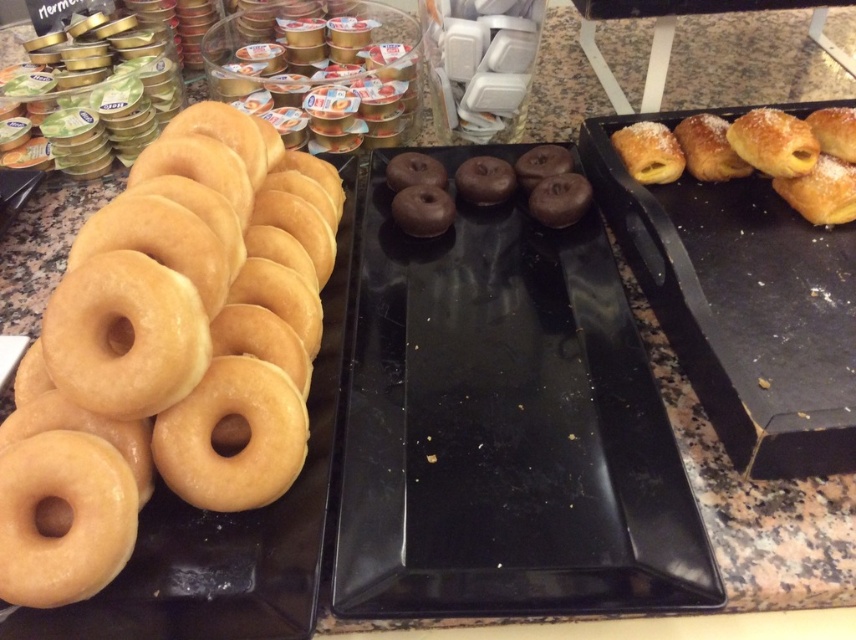
You are a customer at a bakery and see the glossy glazed donut at left and the golden matte donut at left. Which one is placed higher on the tray?

The glossy glazed donut at left is positioned over golden matte donut at left, so it is placed higher on the tray.

You are a customer at a bakery and you want to choose a donut that is taller. You see the glossy glazed donut at left and the golden matte donut at left. Which one should you pick?

The glossy glazed donut at left is taller than the golden matte donut at left, so you should pick the glossy glazed donut at left.

You are standing in front of a display of baked goods. There are three trays on the countertop. The left tray has golden glazed donuts, the center tray has chocolate donuts, and the right tray has powdered sugar pastries. A customer points to a specific location on the display and says, I want the item at point (169,353). Which tray should you check first?

The glossy glazed donut at left is located at point (169,353), so you should check the left tray first.